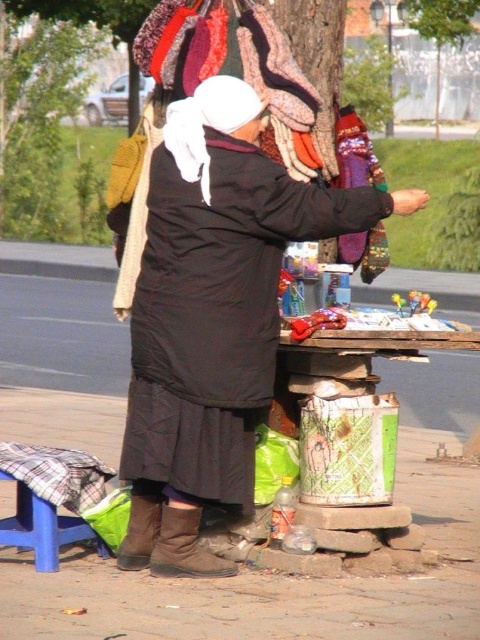
You are a customer approaching the vendor. Which object, the black matte coat at center or the green leafy tree at left, will you encounter first as you walk towards the vendor?

The black matte coat at center will be encountered first because it is closer to the viewer than the green leafy tree at left.

You are a customer at the vendor stall. You want to know which object is taller between the black matte coat at center and the green leafy tree at left. Can you tell me?

The black matte coat at center is not as tall as the green leafy tree at left, so the green leafy tree at left is taller.